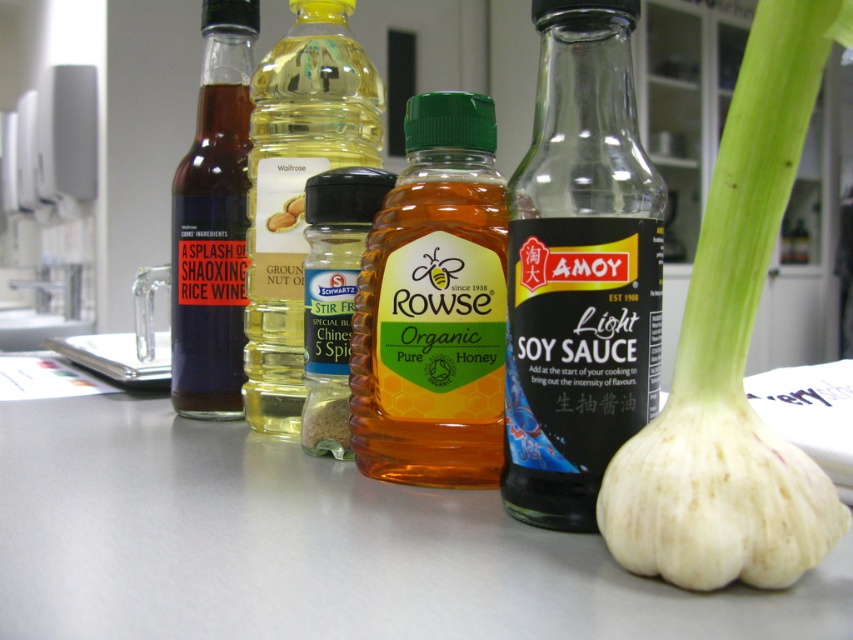
Question: Which of the following is the farthest from the observer?

Choices:
 (A) translucent plastic bottle at center
 (B) matte glass bottle of shaoxing rice wine at left
 (C) golden honey jar at center

Answer: (B)

Question: Is golden honey jar at center closer to camera compared to ground nut oil at center?

Choices:
 (A) no
 (B) yes

Answer: (B)

Question: Which point appears closest to the camera in this image?

Choices:
 (A) (730, 483)
 (B) (590, 490)
 (C) (341, 252)
 (D) (247, 310)

Answer: (A)

Question: Considering the relative positions of golden honey jar at center and translucent plastic bottle at center in the image provided, where is golden honey jar at center located with respect to translucent plastic bottle at center?

Choices:
 (A) below
 (B) above

Answer: (A)

Question: Which point is farther to the camera?

Choices:
 (A) (344, 157)
 (B) (677, 536)
 (C) (532, 120)
 (D) (183, 216)

Answer: (C)

Question: Considering the relative positions of golden honey jar at center and translucent plastic bottle at center in the image provided, where is golden honey jar at center located with respect to translucent plastic bottle at center?

Choices:
 (A) left
 (B) right

Answer: (B)